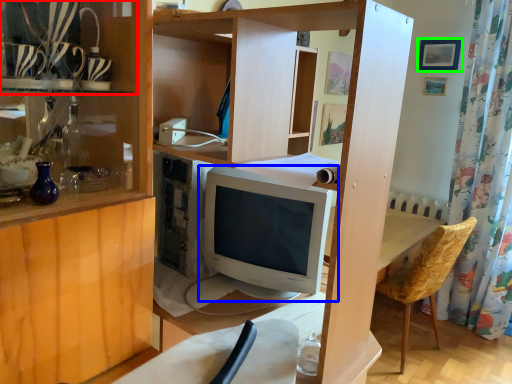
Question: Based on their relative distances, which object is farther from shelf (highlighted by a red box)? Choose from computer monitor (highlighted by a blue box) and picture frame (highlighted by a green box).

Choices:
 (A) computer monitor
 (B) picture frame

Answer: (B)